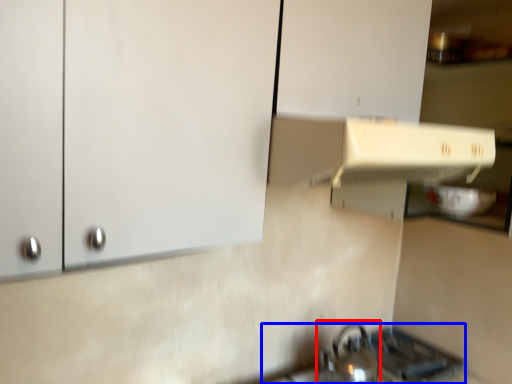
Question: Among these objects, which one is nearest to the camera, tea pot (highlighted by a red box) or gas stove (highlighted by a blue box)?

Choices:
 (A) tea pot
 (B) gas stove

Answer: (A)